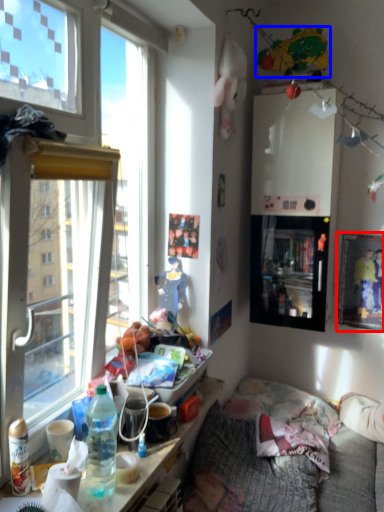
Question: Which point is further to the camera, picture frame (highlighted by a red box) or toy (highlighted by a blue box)?

Choices:
 (A) picture frame
 (B) toy

Answer: (A)